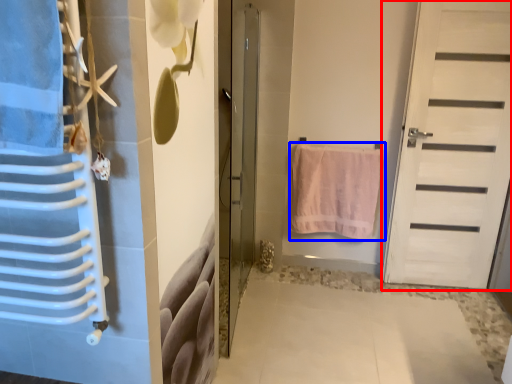
Question: Which of the following is the closest to the observer, door (highlighted by a red box) or towel (highlighted by a blue box)?

Choices:
 (A) door
 (B) towel

Answer: (A)